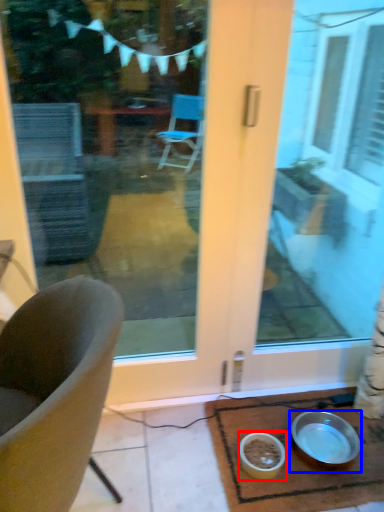
Question: Which object is further to the camera taking this photo, bowl (highlighted by a red box) or bowl (highlighted by a blue box)?

Choices:
 (A) bowl
 (B) bowl

Answer: (B)